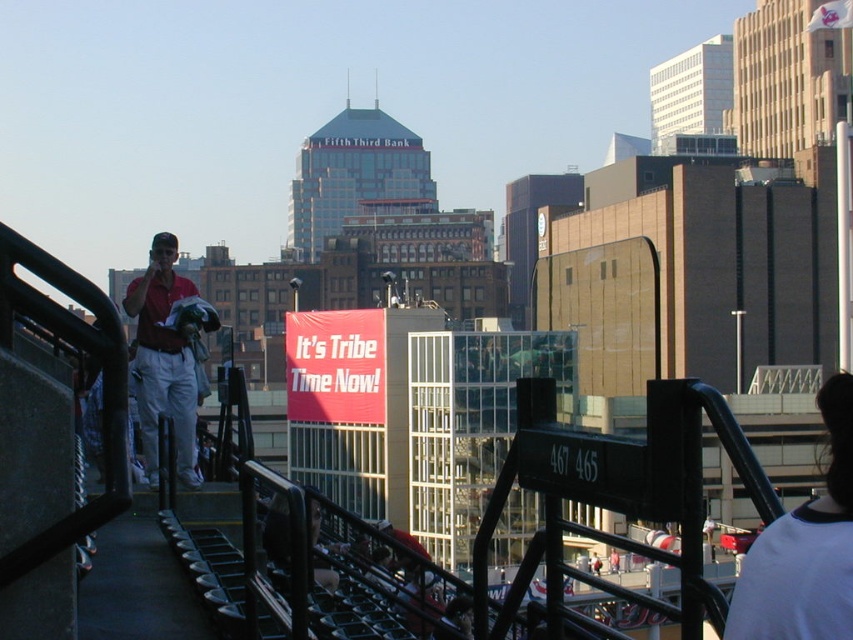
Between white jersey at upper right and matte red shirt at left, which one appears on the left side from the viewer's perspective?

Positioned to the left is matte red shirt at left.

Can you confirm if white jersey at upper right is wider than matte red shirt at left?

In fact, white jersey at upper right might be narrower than matte red shirt at left.

This screenshot has width=853, height=640. I want to click on white jersey at upper right, so click(x=804, y=548).